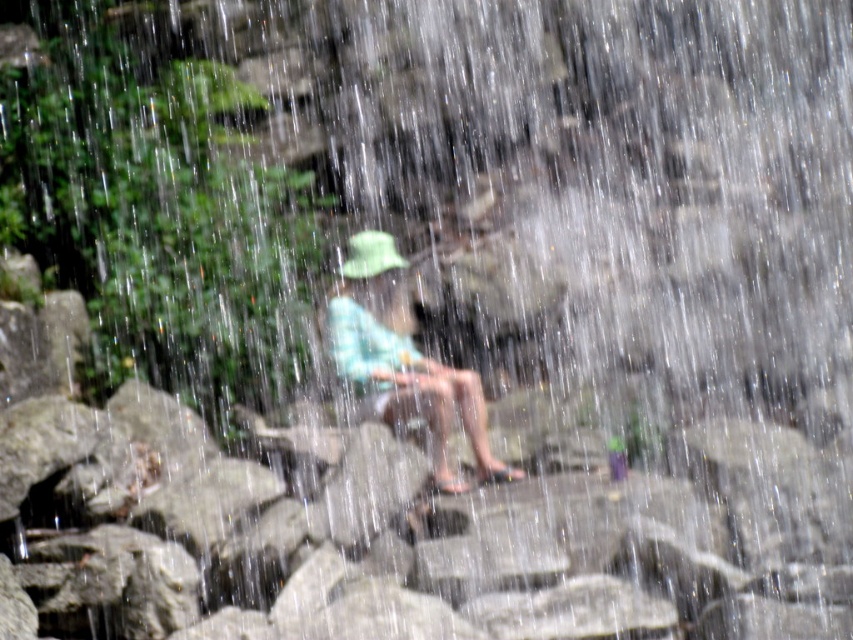
You are a photographer trying to capture a clear photo of the person sitting at the center. You notice two hats, the light blue fabric hat at center and the green fabric hat at center, in your viewfinder. Which hat is closer to the camera based on their positions?

The light blue fabric hat at center and green fabric hat at center are 16.14 inches apart, but the description does not specify which one is closer to the camera. Therefore, it is impossible to determine which hat is closer based on the given information.

You are a photographer trying to capture the light blue fabric hat at center and the green fabric hat at center in the scene. Since the waterfall creates mist, which hat will appear clearer in your photo?

The light blue fabric hat at center will appear clearer in the photo because it is closer to the viewer than the green fabric hat at center, making it less obscured by the mist.